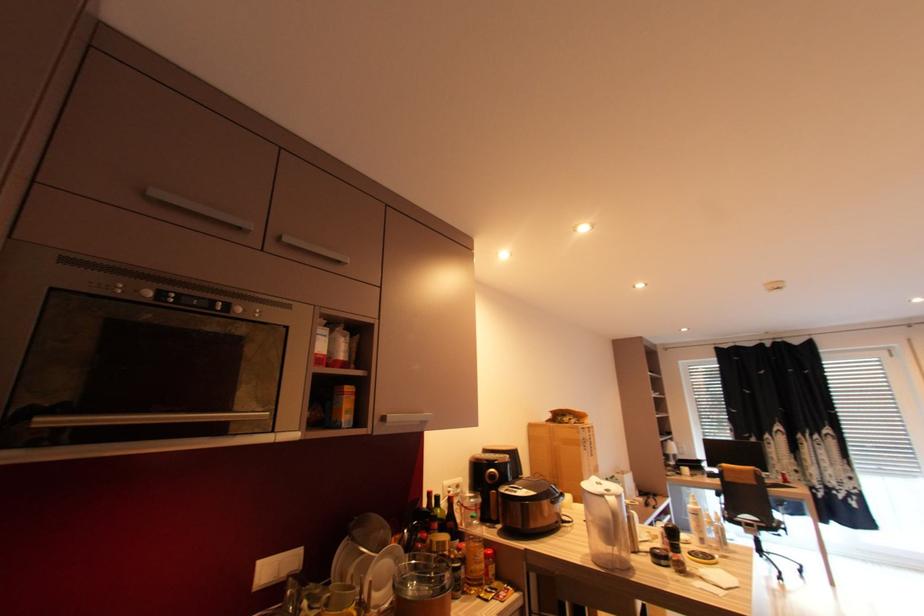
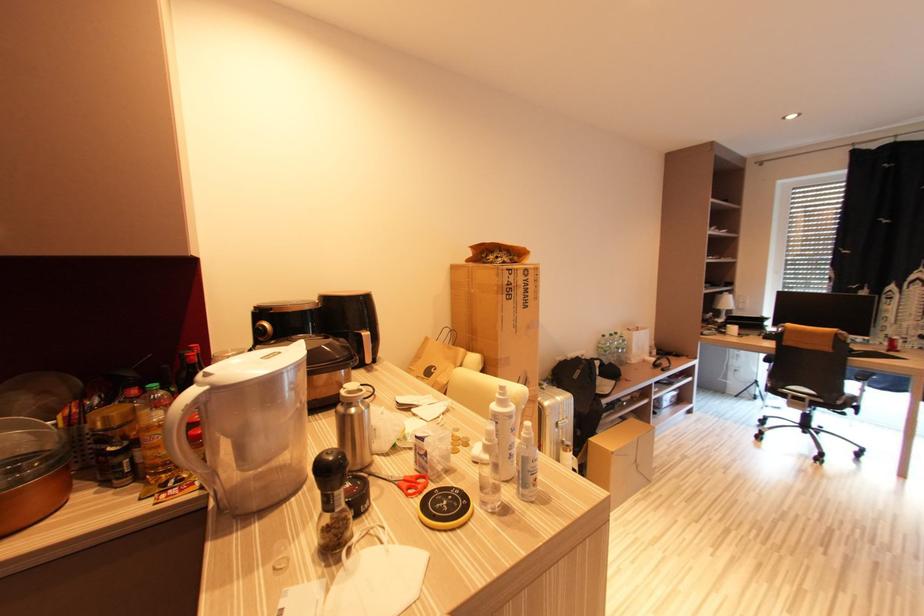
In a continuous first-person perspective shot, in which direction is the camera moving?

The cameraman moved toward right, forward.